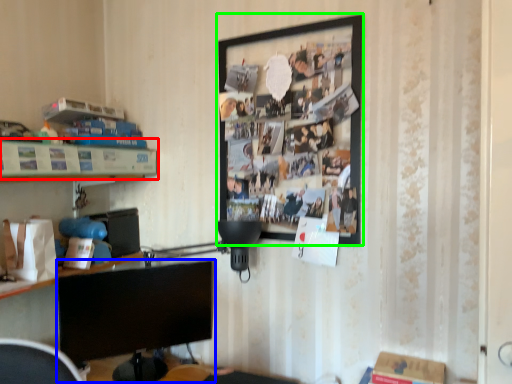
Question: Which is nearer to the shelf (highlighted by a red box)? computer monitor (highlighted by a blue box) or picture frame (highlighted by a green box).

Choices:
 (A) computer monitor
 (B) picture frame

Answer: (A)